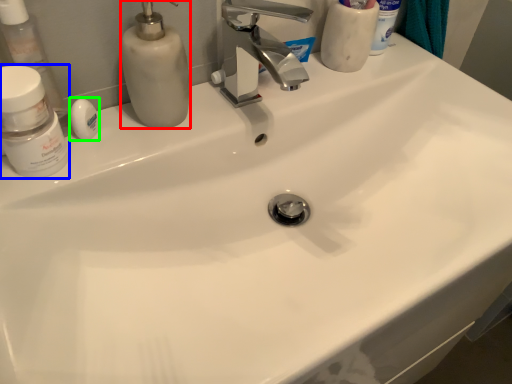
Question: Which is nearer to the soap dispenser (highlighted by a red box)? mouthwash (highlighted by a blue box) or soap (highlighted by a green box).

Choices:
 (A) mouthwash
 (B) soap

Answer: (B)